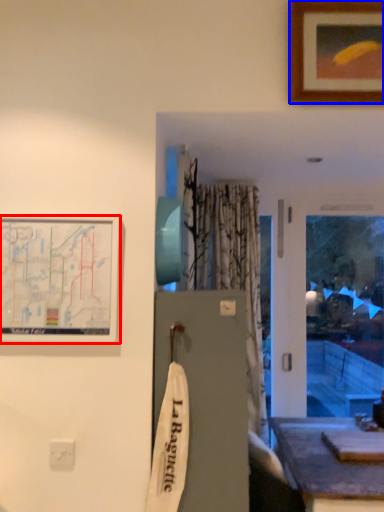
Question: Which object appears farthest to the camera in this image, picture frame (highlighted by a red box) or picture frame (highlighted by a blue box)?

Choices:
 (A) picture frame
 (B) picture frame

Answer: (B)